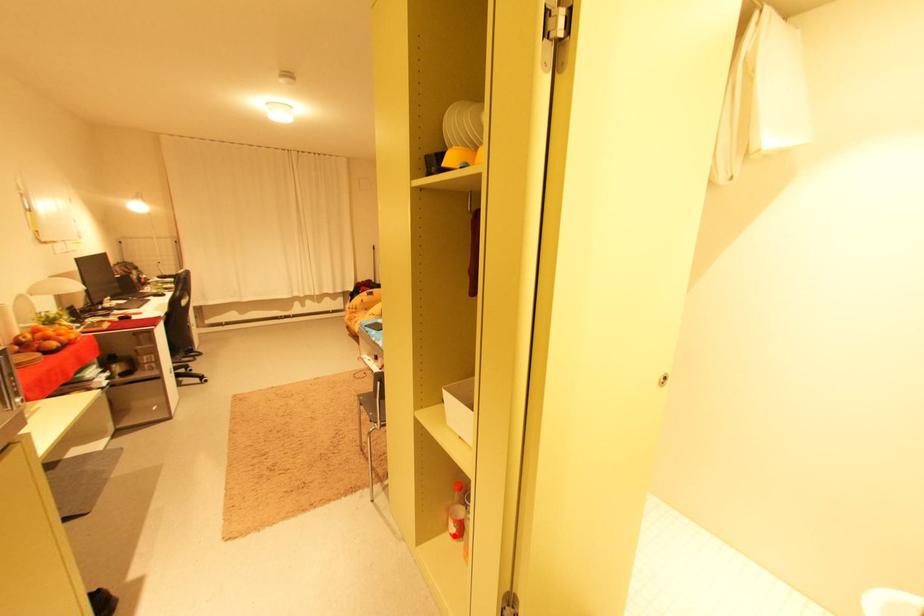
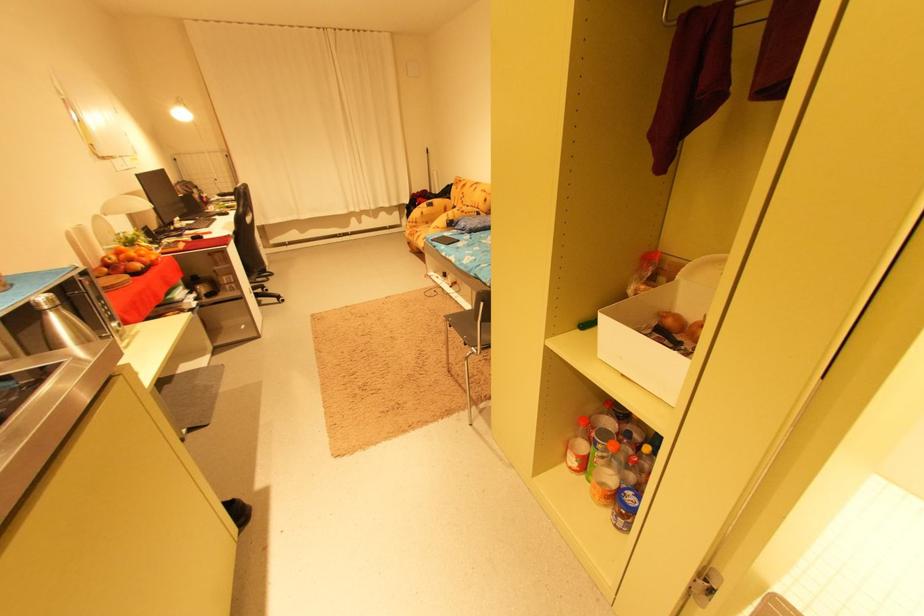
Locate, in the second image, the point that corresponds to the highlighted location in the first image.

(572, 467)